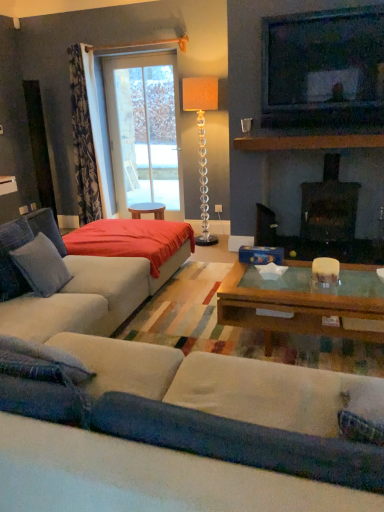
Question: In the image, is black glass fireplace at center positioned in front of or behind soft gray fabric pillow at left?

Choices:
 (A) behind
 (B) front

Answer: (A)

Question: Considering the relative positions of black glass fireplace at center and soft gray fabric pillow at left in the image provided, is black glass fireplace at center to the left or to the right of soft gray fabric pillow at left?

Choices:
 (A) right
 (B) left

Answer: (A)

Question: Which is nearer to the velvet beige couch at lower center?

Choices:
 (A) soft gray fabric pillow at left
 (B) brown wooden mantle at upper center
 (C) translucent glass floor lamp at upper center
 (D) red fabric bed at center
 (E) matte black television at upper right

Answer: (A)

Question: Which object is positioned farthest from the transparent glass door at upper center?

Choices:
 (A) brown wooden mantle at upper center
 (B) matte black television at upper right
 (C) translucent glass floor lamp at upper center
 (D) soft gray fabric pillow at left
 (E) red fabric bed at center

Answer: (D)